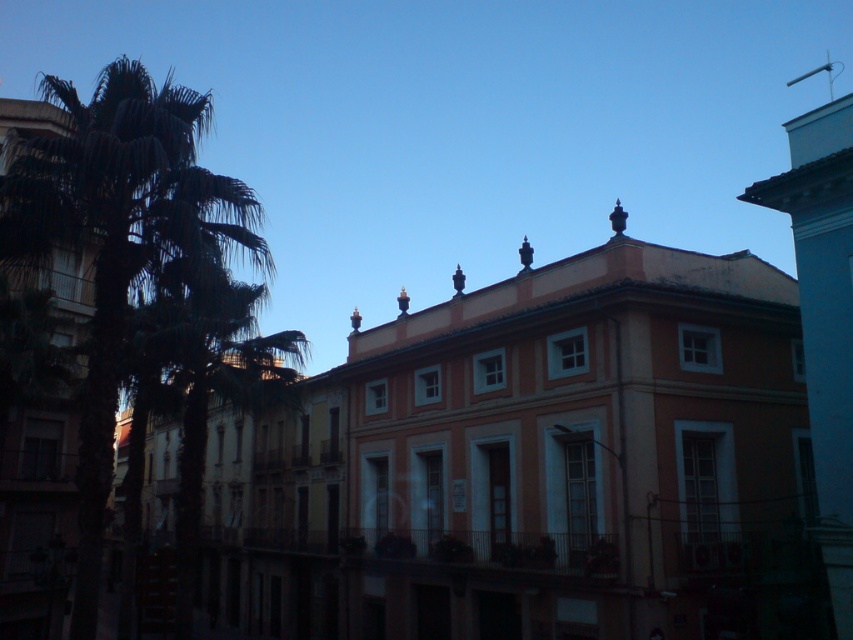
Is dark green leafy palm tree at left shorter than shiny bronze finial at upper center?

In fact, dark green leafy palm tree at left may be taller than shiny bronze finial at upper center.

Does point (186, 106) lie in front of point (616, 202)?

Yes.

The width and height of the screenshot is (853, 640). Describe the element at coordinates (128, 246) in the screenshot. I see `dark green leafy palm tree at left` at that location.

The height and width of the screenshot is (640, 853). Identify the location of dark green leafy palm tree at left. (128, 246).